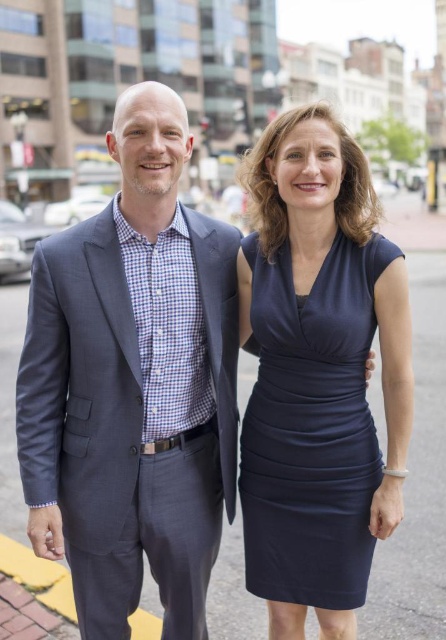
Based on the photo, does navy satin dress at center have a greater height compared to dark gray asphalt at center?

In fact, navy satin dress at center may be shorter than dark gray asphalt at center.

Can you confirm if navy satin dress at center is wider than dark gray asphalt at center?

Incorrect, navy satin dress at center's width does not surpass dark gray asphalt at center's.

You are a GUI agent. You are given a task and a screenshot of the screen. Output one action in this format:
    pyautogui.click(x=<x>, y=<y>)
    Task: Click on the navy satin dress at center
    The image size is (446, 640).
    Given the screenshot: What is the action you would take?
    pyautogui.click(x=310, y=428)

Can you confirm if dark blue textured suit at left is bigger than navy satin dress at center?

Yes, dark blue textured suit at left is bigger than navy satin dress at center.

Does dark blue textured suit at left have a smaller size compared to navy satin dress at center?

No.

The height and width of the screenshot is (640, 446). I want to click on dark blue textured suit at left, so [132, 385].

Find the location of a particular element. dark blue textured suit at left is located at coordinates (132, 385).

Does dark blue textured suit at left have a greater height compared to dark gray asphalt at center?

Correct, dark blue textured suit at left is much taller as dark gray asphalt at center.

Does dark blue textured suit at left appear on the left side of dark gray asphalt at center?

Indeed, dark blue textured suit at left is positioned on the left side of dark gray asphalt at center.

Find the location of a particular element. dark blue textured suit at left is located at coordinates (132, 385).